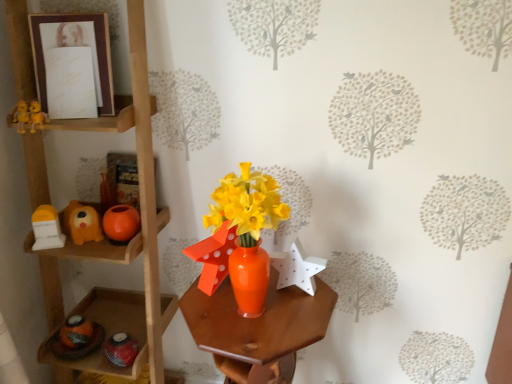
Question: Is orange matte ball at left, acting as the 2th toy starting from the left, in contact with matte brown picture frame at upper left?

Choices:
 (A) no
 (B) yes

Answer: (A)

Question: Does orange matte ball at left, which appears as the second toy when viewed from the right, have a lesser height compared to matte brown picture frame at upper left?

Choices:
 (A) no
 (B) yes

Answer: (B)

Question: Is orange matte ball at left, acting as the 2th toy starting from the left, far away from matte brown picture frame at upper left?

Choices:
 (A) no
 (B) yes

Answer: (A)

Question: Can you confirm if orange matte ball at left, acting as the 2th toy starting from the left, is smaller than matte brown picture frame at upper left?

Choices:
 (A) yes
 (B) no

Answer: (A)

Question: From the image's perspective, would you say orange matte ball at left, acting as the 2th toy starting from the left, is positioned over matte brown picture frame at upper left?

Choices:
 (A) yes
 (B) no

Answer: (B)

Question: Considering the positions of point (90, 238) and point (111, 215), is point (90, 238) closer or farther from the camera than point (111, 215)?

Choices:
 (A) farther
 (B) closer

Answer: (A)

Question: Looking at their shapes, would you say matte orange dog at left, the first toy when ordered from left to right, is wider or thinner than orange matte ball at left, which appears as the second toy when viewed from the right?

Choices:
 (A) thin
 (B) wide

Answer: (B)

Question: From a real-world perspective, relative to orange matte ball at left, acting as the 2th toy starting from the left, is matte orange dog at left, the first toy when ordered from left to right, vertically above or below?

Choices:
 (A) above
 (B) below

Answer: (A)

Question: In terms of height, does matte orange dog at left, the first toy when ordered from left to right, look taller or shorter compared to orange matte ball at left, which appears as the second toy when viewed from the right?

Choices:
 (A) short
 (B) tall

Answer: (B)

Question: Relative to wooden shelf at left, is matte brown picture frame at upper left in front or behind?

Choices:
 (A) behind
 (B) front

Answer: (A)

Question: Would you say matte brown picture frame at upper left is inside or outside wooden shelf at left?

Choices:
 (A) inside
 (B) outside

Answer: (A)

Question: Based on their positions, is matte brown picture frame at upper left located to the left or right of wooden shelf at left?

Choices:
 (A) right
 (B) left

Answer: (B)

Question: From the image's perspective, is matte brown picture frame at upper left above or below wooden shelf at left?

Choices:
 (A) above
 (B) below

Answer: (A)

Question: From the image's perspective, relative to matte orange dog at left, the first toy when ordered from left to right, is orange matte ball at left, which appears as the second toy when viewed from the right, above or below?

Choices:
 (A) below
 (B) above

Answer: (A)

Question: Is orange matte ball at left, which appears as the second toy when viewed from the right, wider or thinner than matte orange dog at left, positioned as the third toy in right-to-left order?

Choices:
 (A) thin
 (B) wide

Answer: (A)